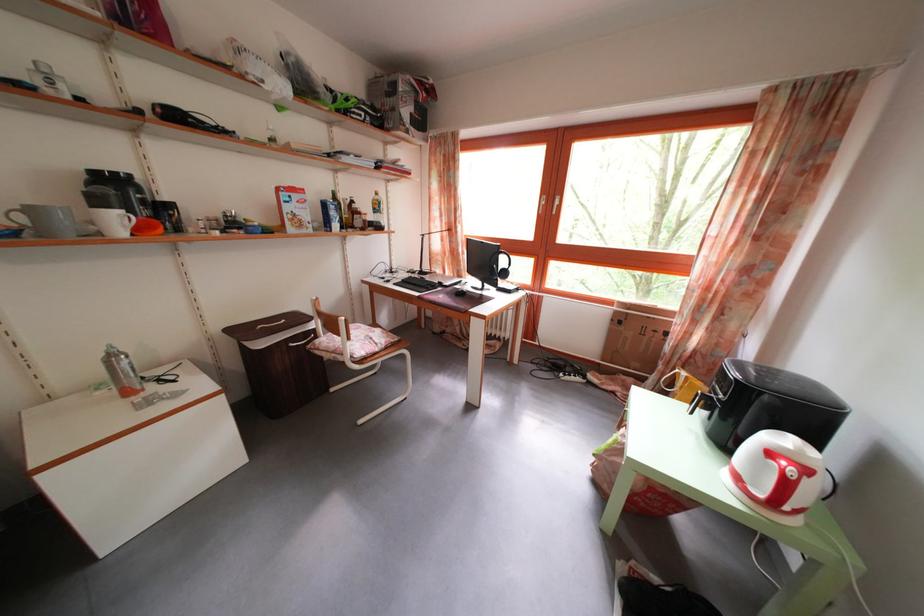
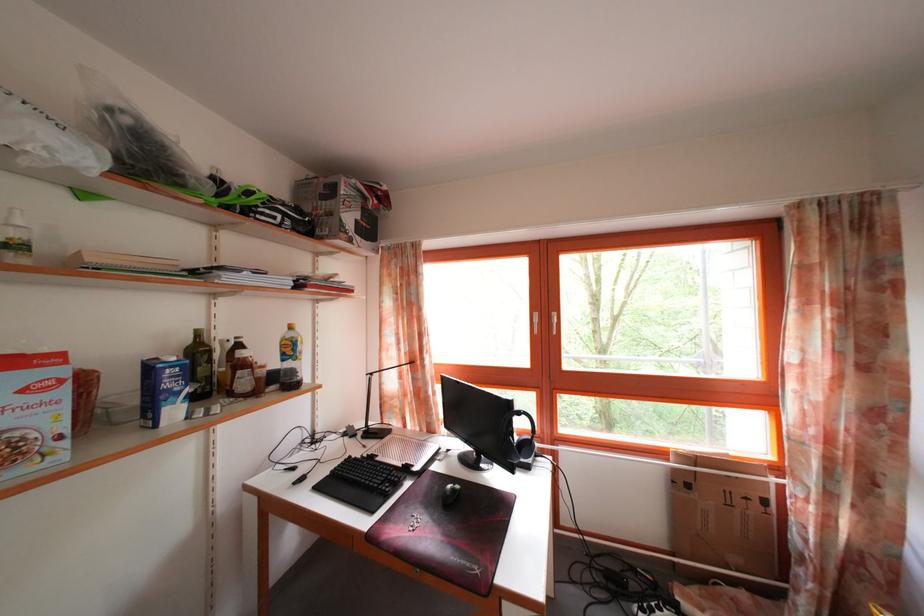
Question: In a continuous first-person perspective shot, in which direction is the camera moving?

Choices:
 (A) Left
 (B) Right
 (C) Forward
 (D) Backward

Answer: (C)